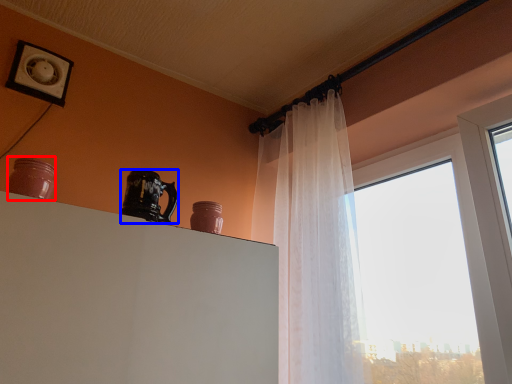
Question: Which point is further to the camera, pottery (highlighted by a red box) or coffee cup (highlighted by a blue box)?

Choices:
 (A) pottery
 (B) coffee cup

Answer: (B)